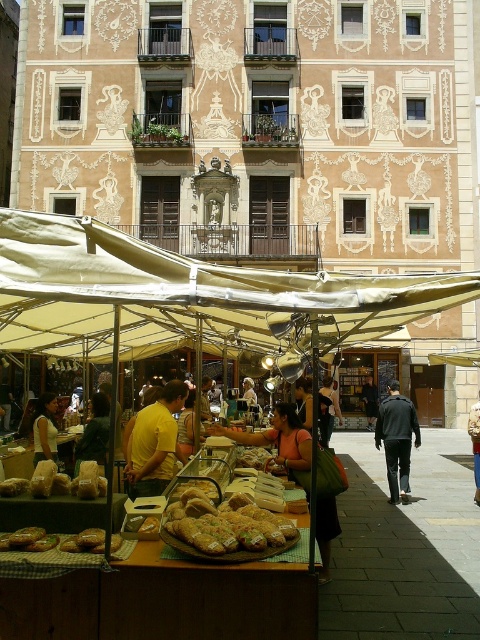
Question: Which point is farther to the camera?

Choices:
 (A) beige fabric canopy at center
 (B) light brown leather jacket at center
 (C) golden brown crusty bread at center

Answer: (B)

Question: Observing the image, what is the correct spatial positioning of yellow matte shirt at center in reference to light brown leather jacket at center?

Choices:
 (A) below
 (B) above

Answer: (B)

Question: Based on their relative distances, which object is farther from the golden brown bread at lower left?

Choices:
 (A) yellow matte shirt at center
 (B) golden brown crusty bread at center

Answer: (A)

Question: Can you confirm if matte yellow shirt at center is thinner than light brown leather jacket at center?

Choices:
 (A) no
 (B) yes

Answer: (B)

Question: Can you confirm if dark green fabric at center is positioned above light brown leather jacket at center?

Choices:
 (A) yes
 (B) no

Answer: (A)

Question: Which object appears closest to the camera in this image?

Choices:
 (A) light brown leather jacket at center
 (B) matte yellow shirt at center
 (C) dark green fabric at center

Answer: (C)